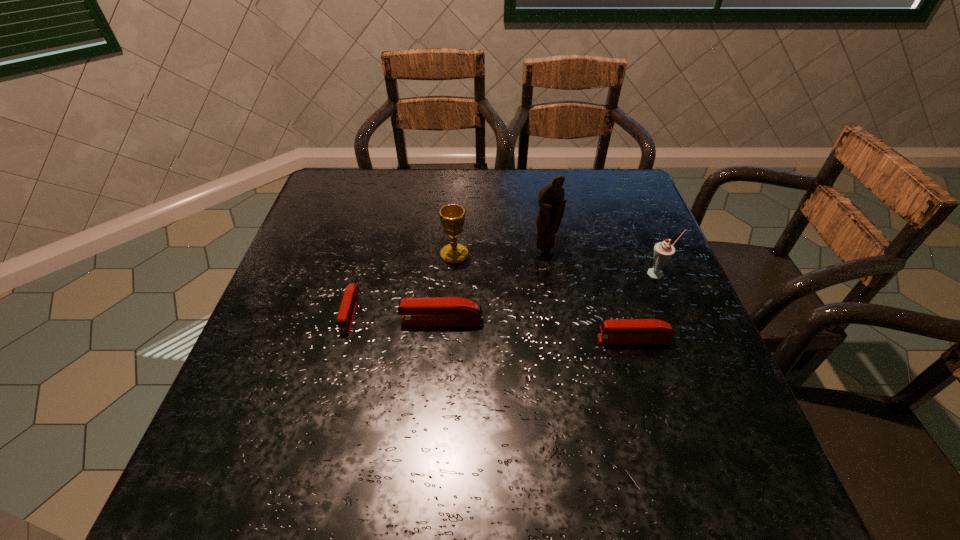
Identify which object is the third closest to the figurine. Please provide its 2D coordinates. Your answer should be formatted as a tuple, i.e. [(x, y)], where the tuple contains the x and y coordinates of a point satisfying the conditions above.

[(433, 311)]

Select which stapler is the second closest to the chalice. Please provide its 2D coordinates. Your answer should be formatted as a tuple, i.e. [(x, y)], where the tuple contains the x and y coordinates of a point satisfying the conditions above.

[(345, 318)]

Select which stapler appears as the closest to the leftmost stapler. Please provide its 2D coordinates. Your answer should be formatted as a tuple, i.e. [(x, y)], where the tuple contains the x and y coordinates of a point satisfying the conditions above.

[(433, 311)]

I want to click on free space that satisfies the following two spatial constraints: 1. on the straw side of the milkshake; 2. on the front-facing side of the fifth tallest object, so click(x=685, y=340).

You are a GUI agent. You are given a task and a screenshot of the screen. Output one action in this format:
    pyautogui.click(x=<x>, y=<y>)
    Task: Click on the free point that satisfies the following two spatial constraints: 1. on the front side of the chalice; 2. on the front-facing side of the second stapler from left to right
    The width and height of the screenshot is (960, 540).
    Given the screenshot: What is the action you would take?
    pyautogui.click(x=450, y=321)

Locate an element on the screen. This screenshot has height=540, width=960. vacant area that satisfies the following two spatial constraints: 1. on the front-facing side of the figurine; 2. on the front-facing side of the second stapler from left to right is located at coordinates (556, 321).

You are a GUI agent. You are given a task and a screenshot of the screen. Output one action in this format:
    pyautogui.click(x=<x>, y=<y>)
    Task: Click on the vacant area in the image that satisfies the following two spatial constraints: 1. on the straw side of the fourth nearest object; 2. on the front-facing side of the nearest stapler
    Image resolution: width=960 pixels, height=540 pixels.
    Given the screenshot: What is the action you would take?
    pyautogui.click(x=685, y=340)